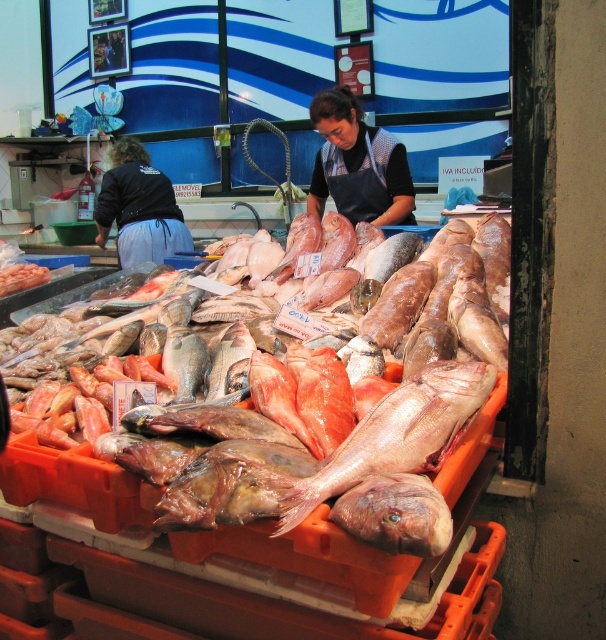
Question: Which point is farther from the camera taking this photo?

Choices:
 (A) (464, 381)
 (B) (441, 540)
 (C) (470, 284)
 (D) (115, 168)

Answer: (D)

Question: Is black fabric apron at left below pink flesh at center?

Choices:
 (A) yes
 (B) no

Answer: (B)

Question: Which point is farther to the camera?

Choices:
 (A) (419, 497)
 (B) (413, 387)
 (C) (219, 456)

Answer: (B)

Question: Does black apron at center have a lesser width compared to black fabric apron at left?

Choices:
 (A) no
 (B) yes

Answer: (B)

Question: Can you confirm if black apron at center is thinner than black fabric apron at left?

Choices:
 (A) no
 (B) yes

Answer: (B)

Question: Which point appears closest to the camera in this image?

Choices:
 (A) (121, 216)
 (B) (358, 166)
 (C) (367, 531)
 (D) (491, 368)

Answer: (C)